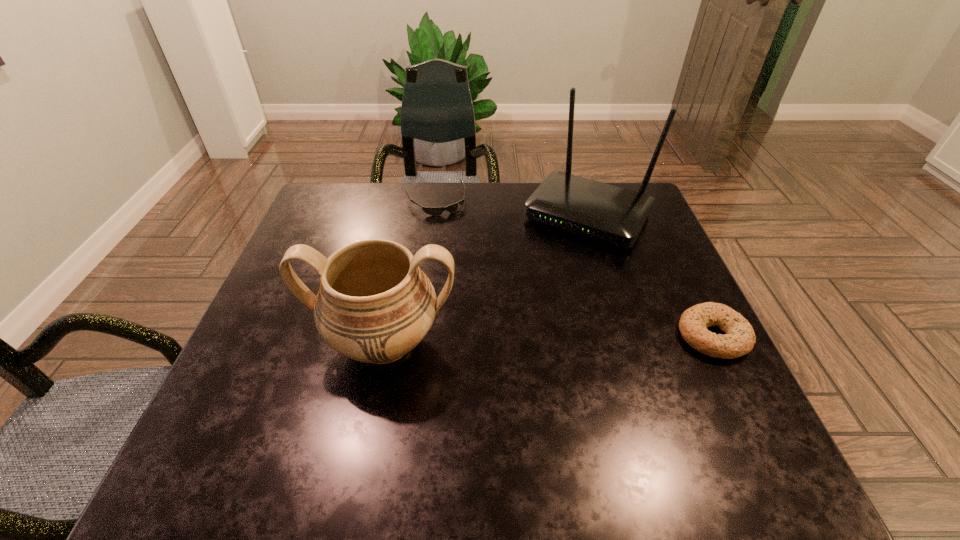
This screenshot has width=960, height=540. Identify the location of vacant region between the router and the shortest object. (512, 208).

Find the location of `unoccupied area between the bagel and the tallest object`. unoccupied area between the bagel and the tallest object is located at coordinates coord(650,275).

Find the location of a particular element. The image size is (960, 540). free space between the bagel and the sunglasses is located at coordinates (574, 268).

Choose which object is the nearest neighbor to the router. Please provide its 2D coordinates. Your answer should be formatted as a tuple, i.e. [(x, y)], where the tuple contains the x and y coordinates of a point satisfying the conditions above.

[(434, 211)]

Identify which object is the third closest to the sunglasses. Please provide its 2D coordinates. Your answer should be formatted as a tuple, i.e. [(x, y)], where the tuple contains the x and y coordinates of a point satisfying the conditions above.

[(739, 340)]

The height and width of the screenshot is (540, 960). Identify the location of vacant space that satisfies the following two spatial constraints: 1. on the front side of the shortest object; 2. on the left side of the bagel. (419, 336).

The height and width of the screenshot is (540, 960). What are the coordinates of `free space that satisfies the following two spatial constraints: 1. on the front side of the sunglasses; 2. on the left side of the router` in the screenshot? It's located at (434, 215).